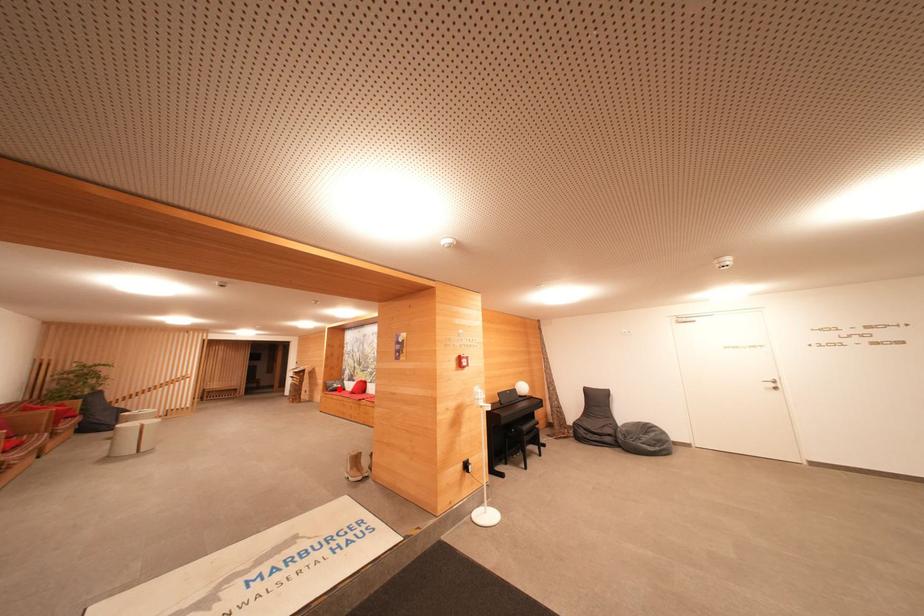
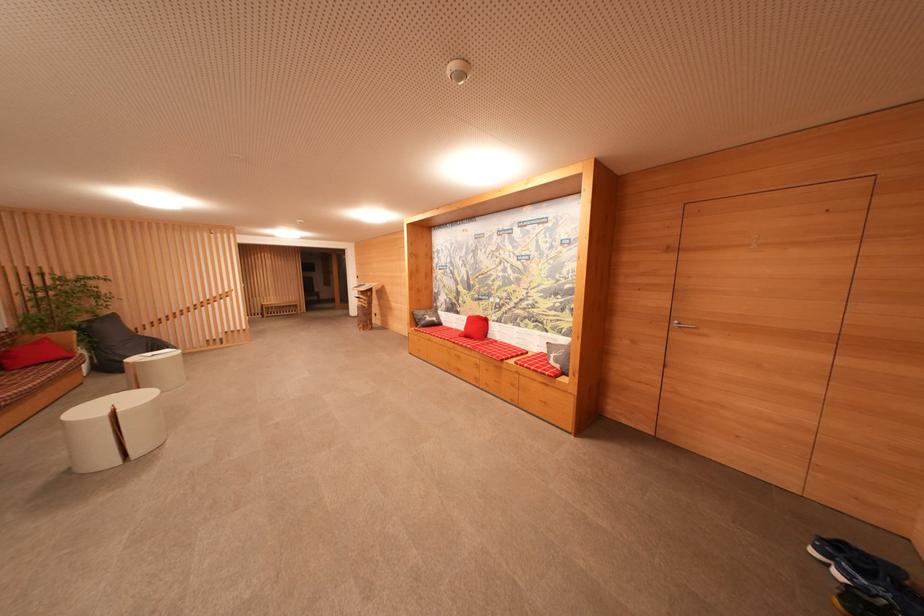
Locate, in the second image, the point that corresponds to the highlighted location in the first image.

(432, 322)